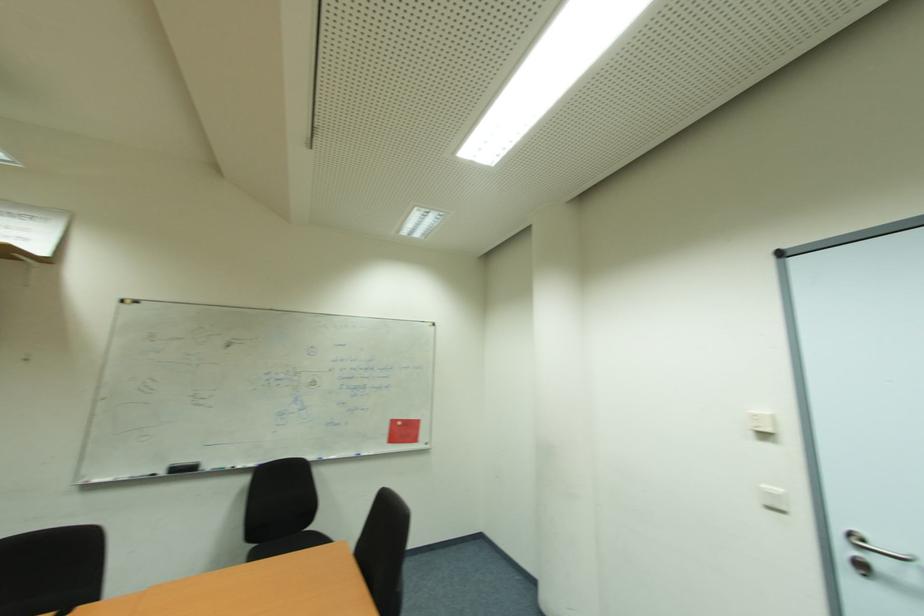
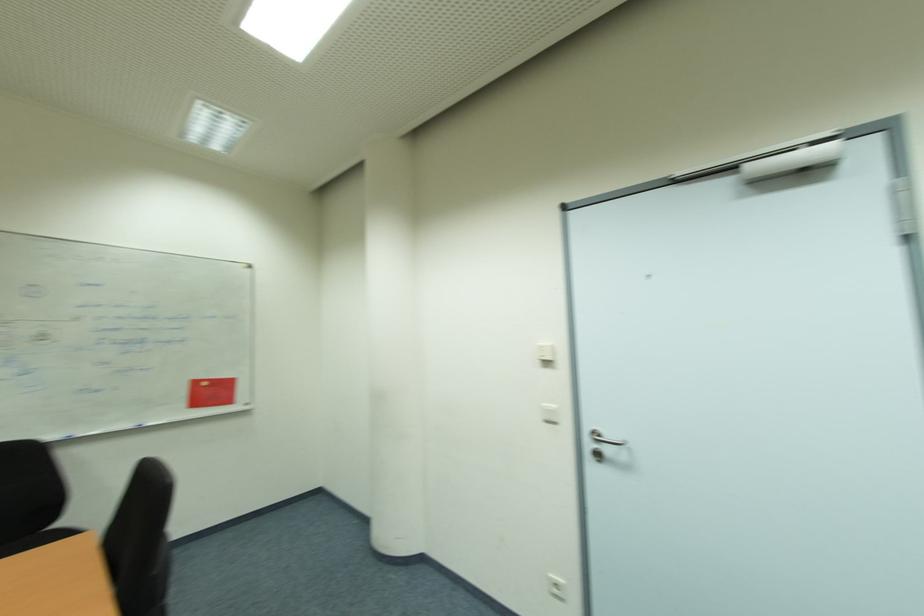
Question: The camera is either moving clockwise (left) or counter-clockwise (right) around the object. The first image is from the beginning of the video and the second image is from the end. Is the camera moving left or right when shooting the video?

Choices:
 (A) Left
 (B) Right

Answer: (A)